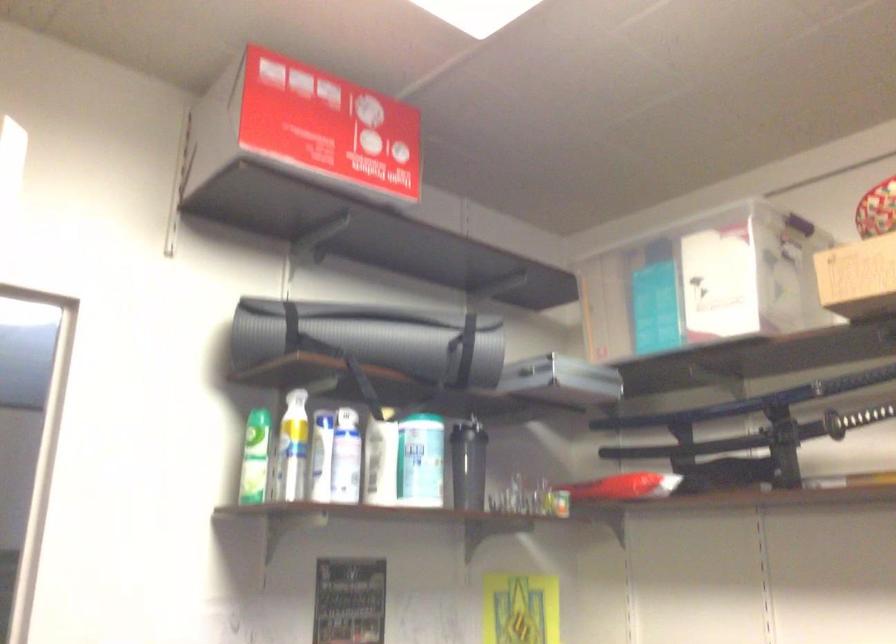
The height and width of the screenshot is (644, 896). In order to click on green spray can in this screenshot , I will do `click(254, 457)`.